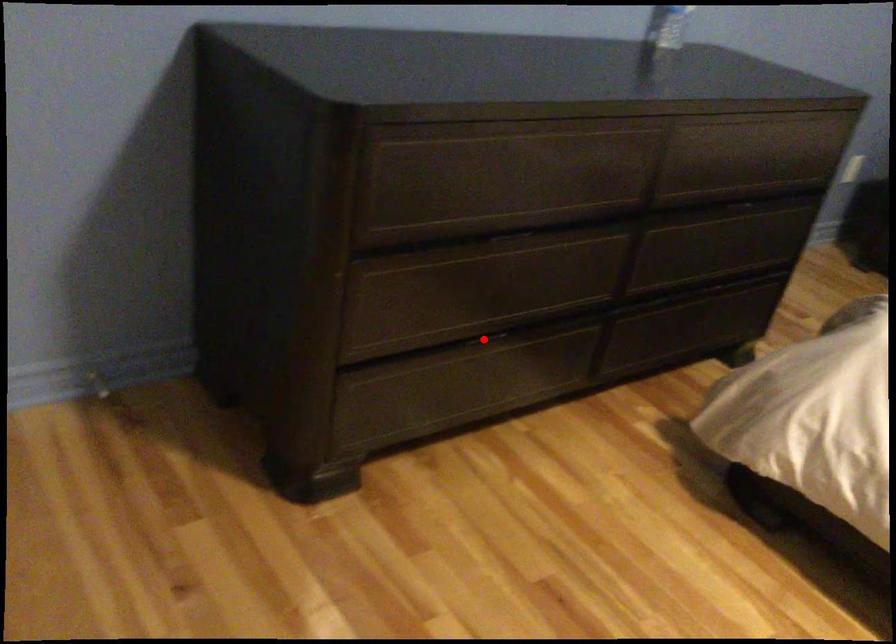
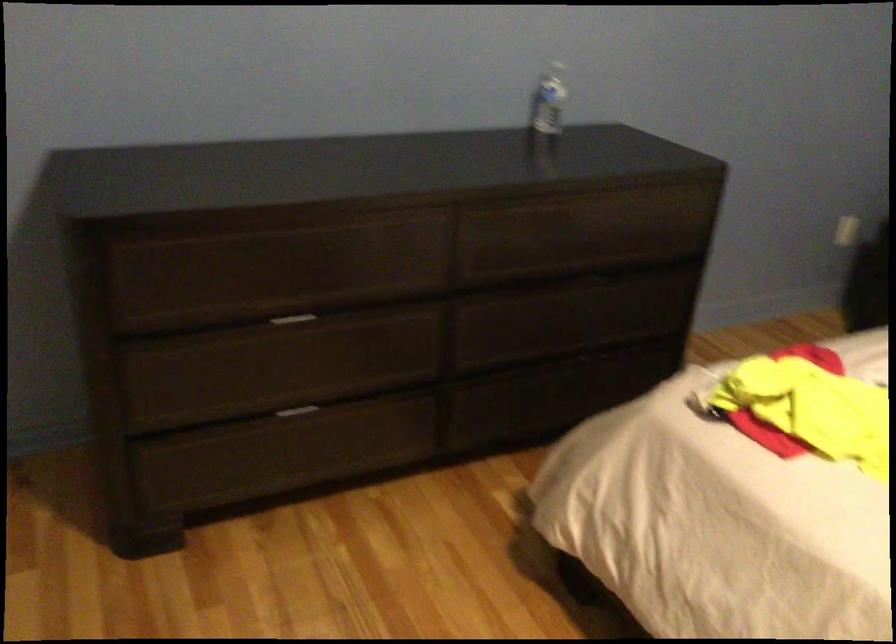
In the second image, find the point that corresponds to the highlighted location in the first image.

(297, 411)